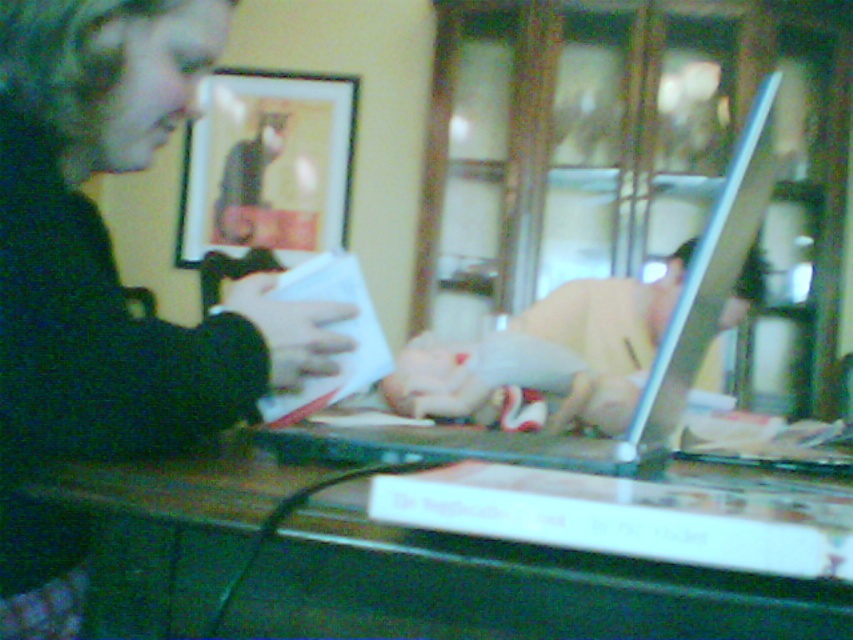
Question: Is matte black laptop at upper right to the right of wooden table at center from the viewer's perspective?

Choices:
 (A) yes
 (B) no

Answer: (B)

Question: Which of these objects is positioned closest to the matte black laptop at upper right?

Choices:
 (A) matte black picture frame at upper center
 (B) smooth beige shirt at center
 (C) wooden table at center
 (D) silver metallic laptop at center

Answer: (C)

Question: Can you confirm if matte black laptop at upper right is positioned to the left of silver metallic laptop at center?

Choices:
 (A) yes
 (B) no

Answer: (A)

Question: Does matte black laptop at upper right come in front of matte black picture frame at upper center?

Choices:
 (A) no
 (B) yes

Answer: (B)

Question: Which object is the farthest from the matte black laptop at upper right?

Choices:
 (A) smooth beige shirt at center
 (B) wooden table at center
 (C) matte black picture frame at upper center

Answer: (C)

Question: Which point is farther to the camera?

Choices:
 (A) (200, 140)
 (B) (625, 458)
 (C) (73, 316)
 (D) (665, 634)

Answer: (A)